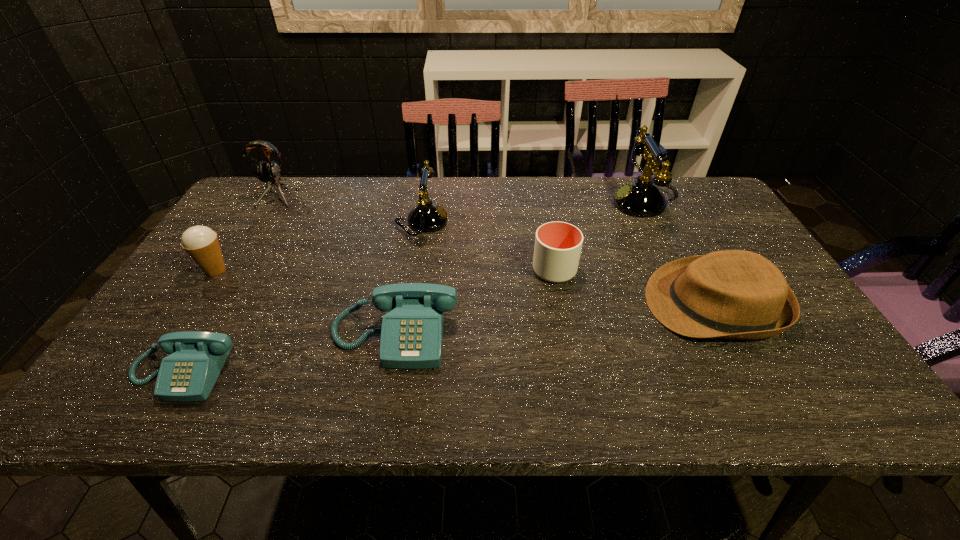
Locate an element on the screen. The image size is (960, 540). the right blue telephone is located at coordinates (412, 331).

At what (x,y) coordinates should I click in order to perform the action: click on the shortest object. Please return your answer as a coordinate pair (x, y). This screenshot has height=540, width=960. Looking at the image, I should click on (189, 373).

The image size is (960, 540). Identify the location of the shortest telephone. (189, 373).

The image size is (960, 540). What are the coordinates of `free space located 0.170m on the dial of the rightmost telephone` in the screenshot? It's located at (559, 202).

This screenshot has height=540, width=960. Find the location of `vacant space located 0.290m on the dial of the rightmost telephone`. vacant space located 0.290m on the dial of the rightmost telephone is located at coordinates (520, 202).

Identify the location of free point located 0.100m on the dial of the rightmost telephone. Image resolution: width=960 pixels, height=540 pixels. (581, 202).

Locate an element on the screen. free location located on the front of the earphone is located at coordinates (230, 266).

The width and height of the screenshot is (960, 540). Identify the location of free space located 0.250m on the dial of the third shortest telephone. (532, 222).

The image size is (960, 540). I want to click on vacant space located on the back of the icecream, so click(267, 192).

You are a GUI agent. You are given a task and a screenshot of the screen. Output one action in this format:
    pyautogui.click(x=<x>, y=<y>)
    Task: Click on the free location located on the right of the white cup
    
    Given the screenshot: What is the action you would take?
    pyautogui.click(x=634, y=270)